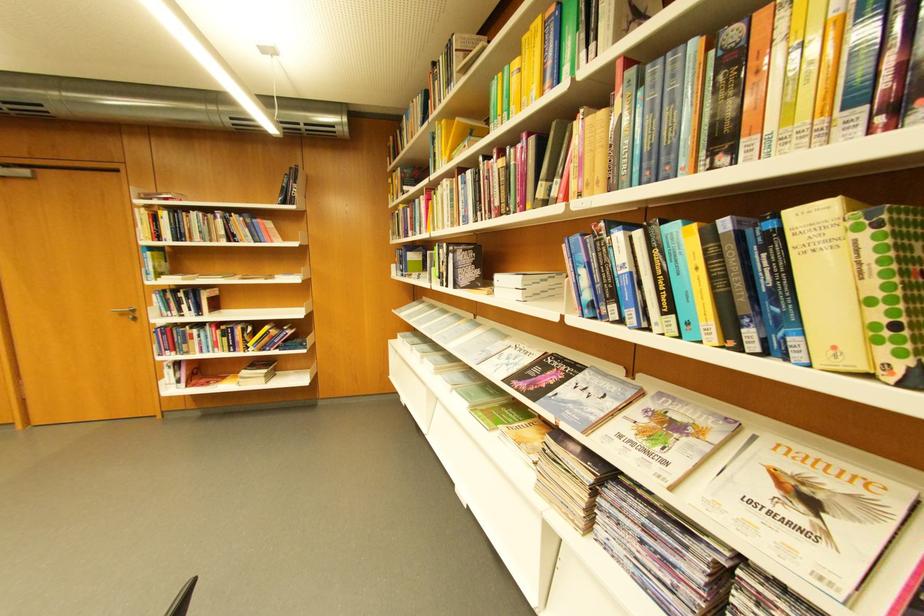
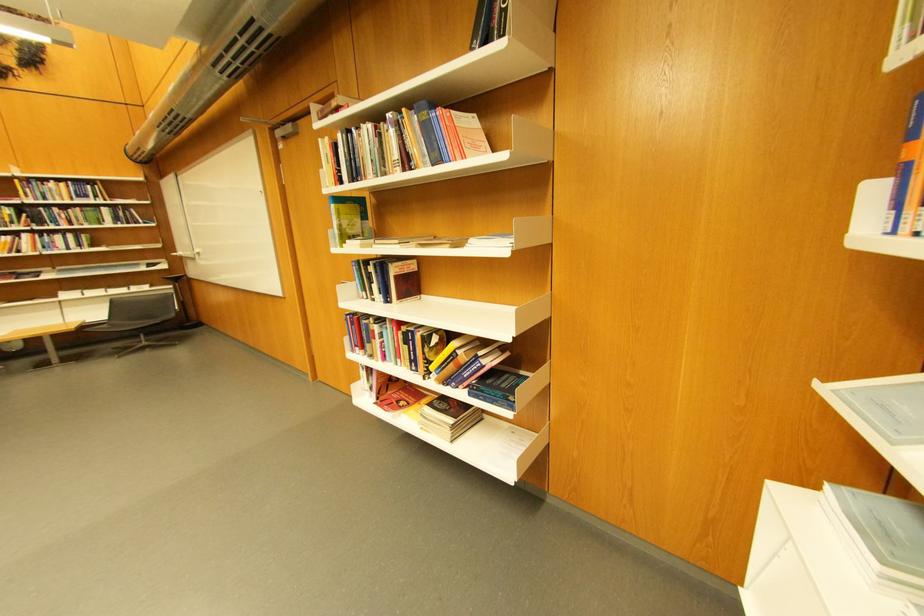
In the second image, find the point that corresponds to point 408,336 in the first image.

(837, 485)